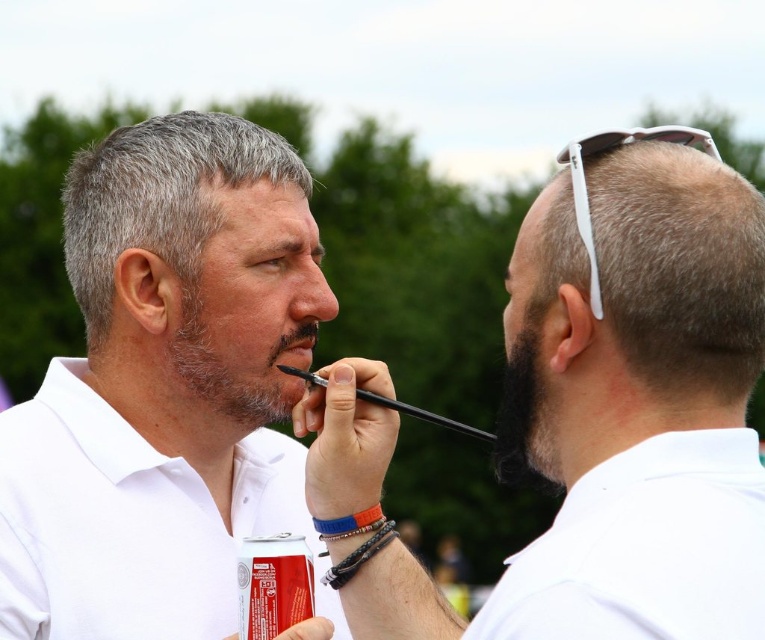
Question: Estimate the real-world distances between objects in this image. Which object is closer to the gray hair at upper right?

Choices:
 (A) black fuzzy beard at right
 (B) white matte shirt at center
 (C) dark brown hair at upper center
 (D) white cotton polo shirt at right

Answer: (A)

Question: Does white cotton polo shirt at right come behind smooth skin at center?

Choices:
 (A) no
 (B) yes

Answer: (A)

Question: Which of the following is the closest to the observer?

Choices:
 (A) gray beard at center
 (B) gray hair at center
 (C) red matte can at lower left
 (D) dark brown hair at upper center

Answer: (C)

Question: Which of the following is the farthest from the observer?

Choices:
 (A) (304, 285)
 (B) (308, 205)
 (C) (614, 387)

Answer: (B)

Question: Can you confirm if gray hair at upper right is bigger than black fuzzy beard at right?

Choices:
 (A) yes
 (B) no

Answer: (A)

Question: Is white cotton polo shirt at right wider than smooth skin at center?

Choices:
 (A) no
 (B) yes

Answer: (B)